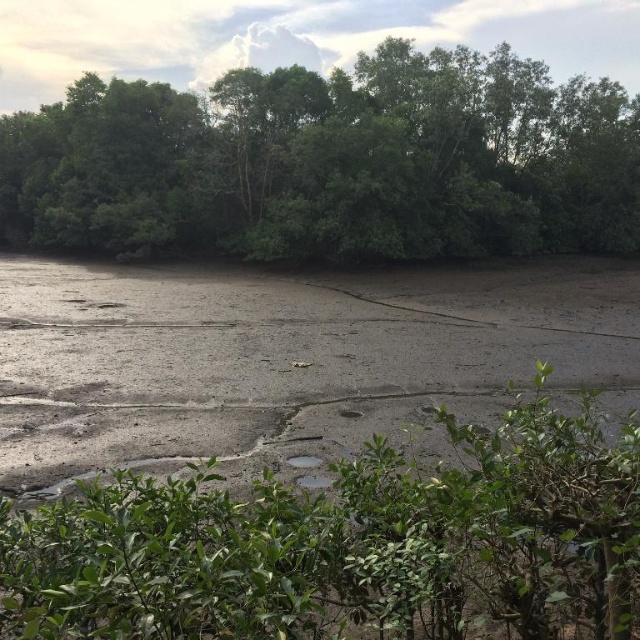
You are a bird looking for a nesting spot in the wetland. Which of the two options would be a better choice for building a nest based on their height? The options are the green leafy trees at upper center and the green leafy bush at center.

The green leafy trees at upper center are much taller than the green leafy bush at center, making them a better choice for building a nest due to their height.

You are a bird flying over the wetland and want to land on the highest point between the green leafy trees at upper center and the green leafy bush at center. Which one should you choose?

The green leafy trees at upper center is located above the green leafy bush at center, so you should choose the green leafy trees at upper center as the highest point to land.